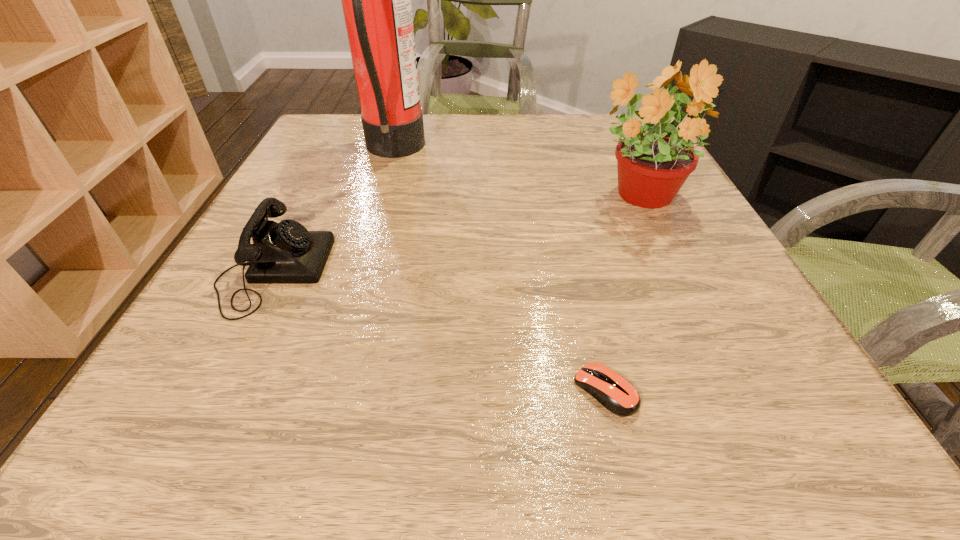
This screenshot has width=960, height=540. Identify the location of vacant area between the second nearest object and the fire extinguisher. (333, 211).

At what (x,y) coordinates should I click in order to perform the action: click on unoccupied position between the tallest object and the third object from left to right. Please return your answer as a coordinate pair (x, y). The width and height of the screenshot is (960, 540). Looking at the image, I should click on (499, 271).

Identify the location of free spot between the third shortest object and the second shortest object. pyautogui.click(x=455, y=234).

The height and width of the screenshot is (540, 960). What are the coordinates of `empty location between the third farthest object and the nearest object` in the screenshot? It's located at (439, 330).

Identify which object is the third closest to the third tallest object. Please provide its 2D coordinates. Your answer should be formatted as a tuple, i.e. [(x, y)], where the tuple contains the x and y coordinates of a point satisfying the conditions above.

[(652, 167)]

This screenshot has height=540, width=960. I want to click on object that stands as the third closest to the tallest object, so click(x=618, y=395).

This screenshot has height=540, width=960. Find the location of `free space in the image that satisfies the following two spatial constraints: 1. on the front-facing side of the tallest object; 2. on the right side of the shortest object`. free space in the image that satisfies the following two spatial constraints: 1. on the front-facing side of the tallest object; 2. on the right side of the shortest object is located at coordinates (x=322, y=390).

Identify the location of vacant space that satisfies the following two spatial constraints: 1. on the front-facing side of the second object from right to left; 2. on the right side of the fire extinguisher. The width and height of the screenshot is (960, 540). (322, 390).

In order to click on free region that satisfies the following two spatial constraints: 1. on the front-facing side of the fire extinguisher; 2. on the left side of the computer mouse in this screenshot , I will do `click(322, 390)`.

This screenshot has width=960, height=540. In order to click on vacant area in the image that satisfies the following two spatial constraints: 1. on the front-facing side of the computer mouse; 2. on the left side of the fire extinguisher in this screenshot , I will do `click(322, 390)`.